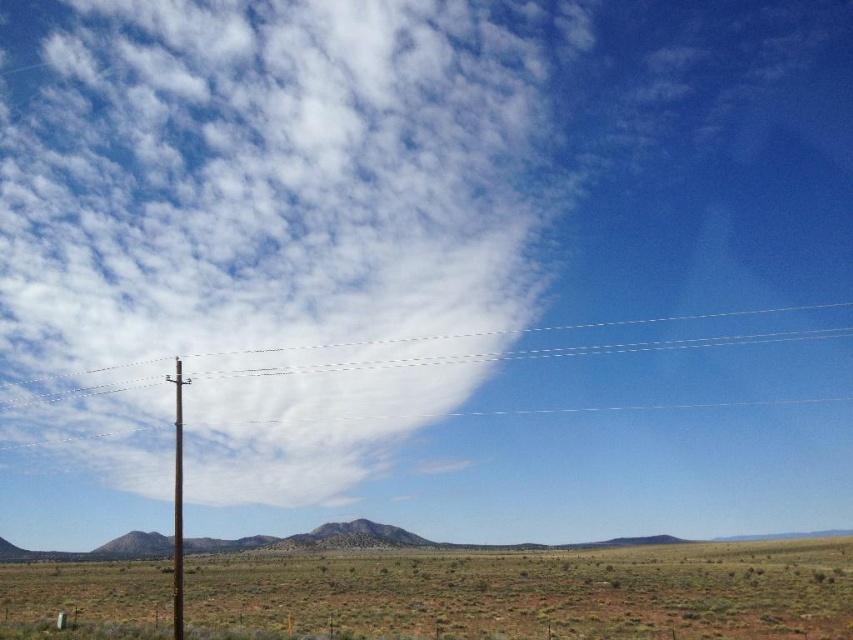
You are a photographer planning to capture a wide landscape shot of the desert scene. You want to ensure that both the white fluffy cloud at upper center and the green matte grassland at lower center are clearly visible in the frame. Given their sizes, which one might require more careful framing to ensure it doesn not get lost in the composition?

The green matte grassland at lower center might require more careful framing since the white fluffy cloud at upper center is wider, making it potentially more dominant in the composition and less likely to be overlooked.

You are a hiker standing at the base of the smooth brown pole at center. Looking towards the rolling hills in the midground, you want to walk straight ahead. Will the green matte grassland at lower center be in your path?

The green matte grassland at lower center is located below the smooth brown pole at center, so if you are standing at the base of the smooth brown pole at center and walk straight ahead, the green matte grassland at lower center will be directly in your path.

You are standing at the point marked by point (x=532, y=593) in the image. Looking around, what type of terrain do you see around you?

The green matte grassland at lower center is represented by point (x=532, y=593), so you are standing in a green matte grassland area.